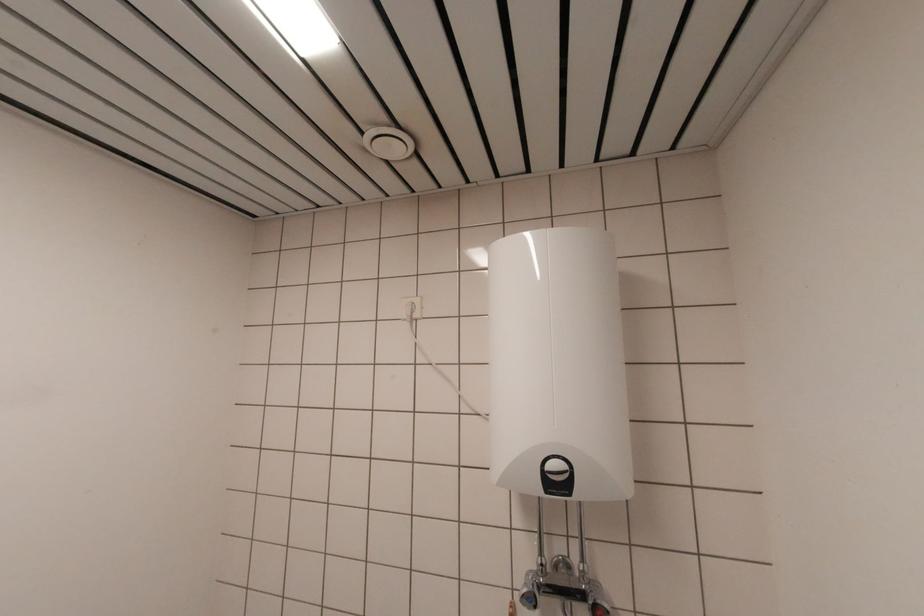
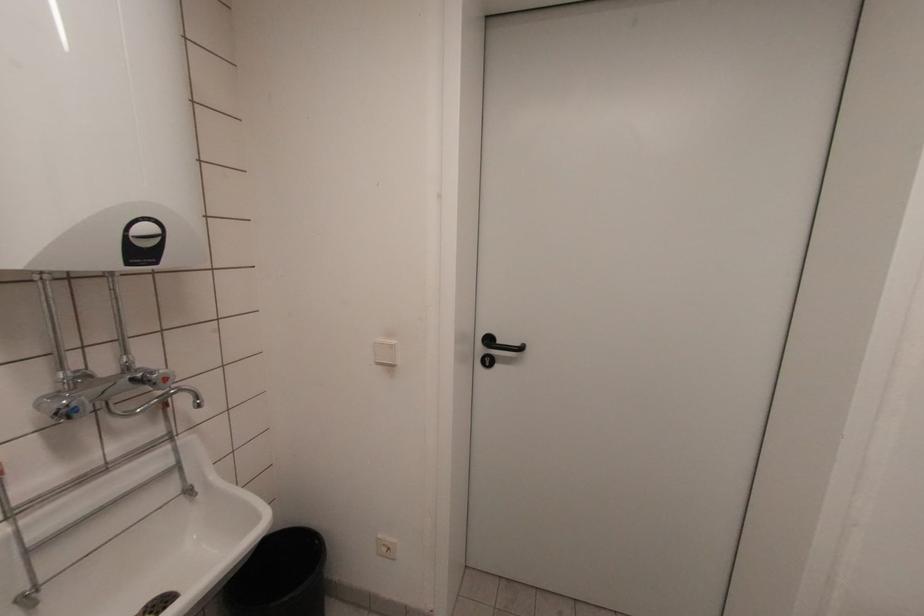
Question: How did the camera likely rotate?

Choices:
 (A) Left
 (B) Right
 (C) Up
 (D) Down

Answer: (B)